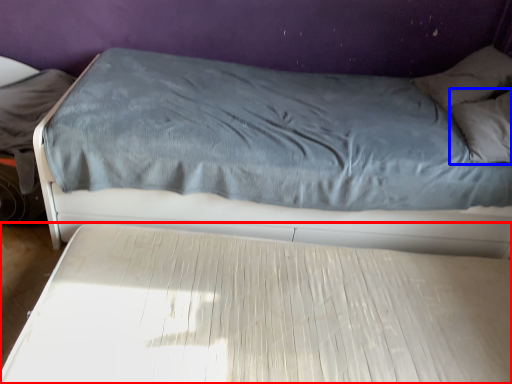
Question: Among these objects, which one is farthest to the camera, bed (highlighted by a red box) or pillow (highlighted by a blue box)?

Choices:
 (A) bed
 (B) pillow

Answer: (B)